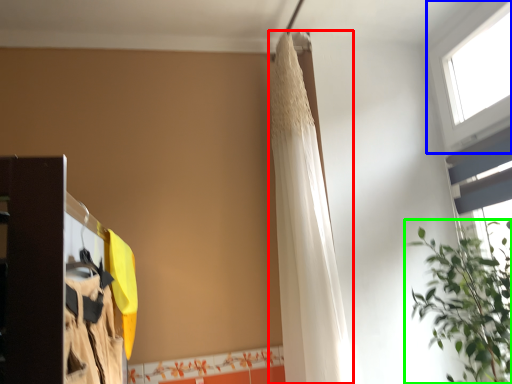
Question: Which object is positioned closest to shower curtain (highlighted by a red box)? Select from window (highlighted by a blue box) and houseplant (highlighted by a green box).

Choices:
 (A) window
 (B) houseplant

Answer: (B)